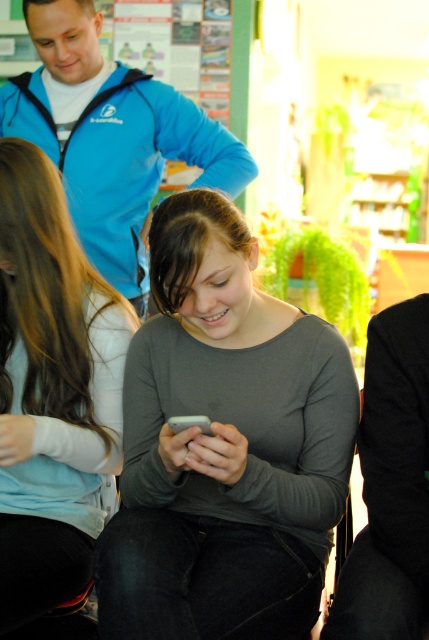
You are standing in the classroom and want to move from point A to point B. Point A is at coordinates point (262,506) and point B is at coordinates point (48,449). According to the scene description, which point is closer to you?

Point (262,506) is in front of point (48,449), so point (262,506) is closer to you.

You are a photographer taking a picture of the scene. You notice the light brown hair at left and the blue fleece jacket at upper left. Which one should you adjust your camera focus to ensure the subject closer to you is in focus?

The light brown hair at left is closer to the viewer than the blue fleece jacket at upper left, so adjust the camera focus on the light brown hair at left to ensure it is in focus.

You are a photographer setting up a shot in this classroom scene. You need to ensure that the gray matte shirt at center and the light brown hair at left are both in focus. Given that your camera has a depth of field that can cover 30 centimeters, will both subjects be in focus?

The gray matte shirt at center is 27.04 centimeters away from the light brown hair at left. Since the distance between them is within the camera lens depth of field of 30 centimeters, both subjects will be in focus.